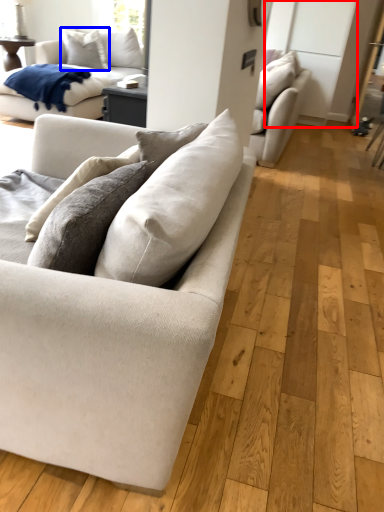
Question: Which object appears farthest to the camera in this image, glass door (highlighted by a red box) or pillow (highlighted by a blue box)?

Choices:
 (A) glass door
 (B) pillow

Answer: (B)